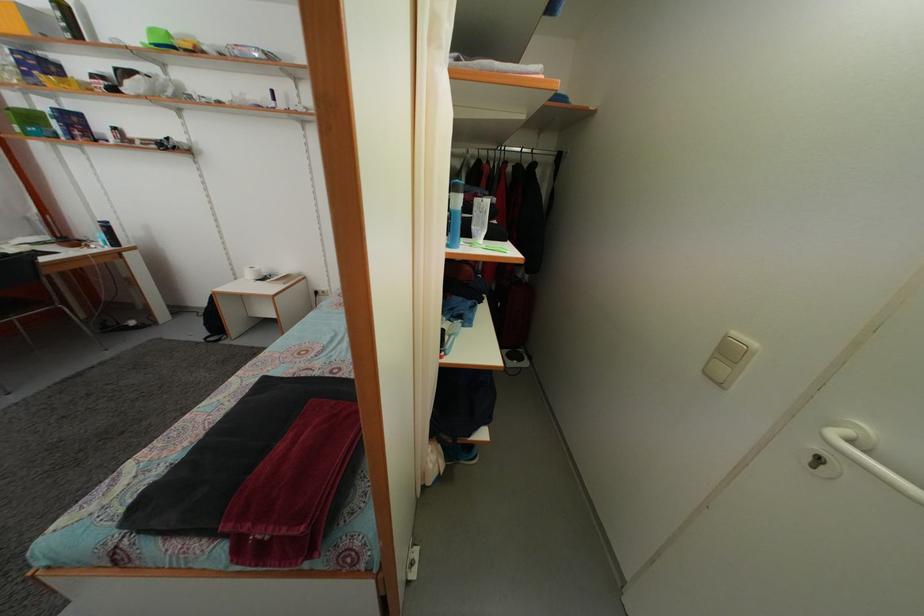
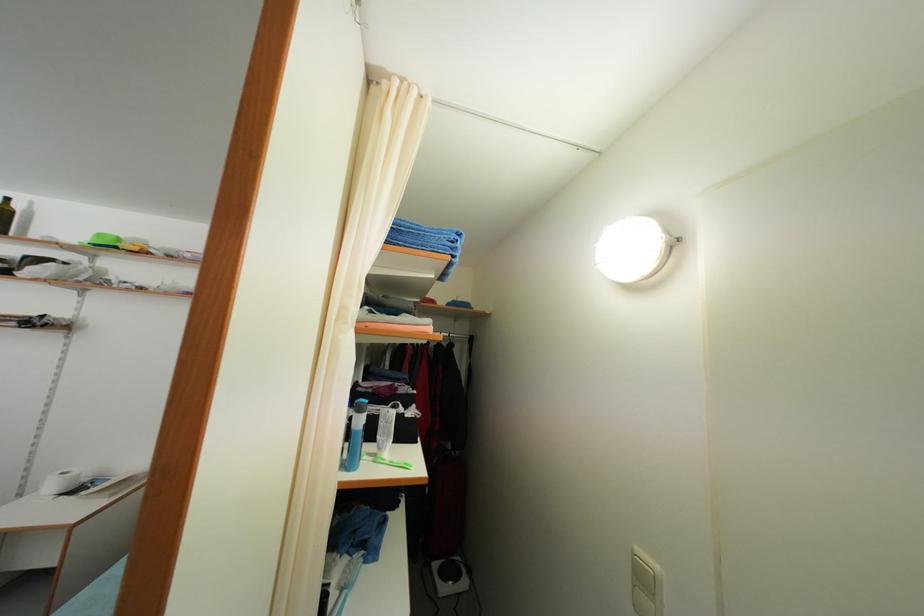
Find the pixel in the second image that matches (254,282) in the first image.

(56, 493)